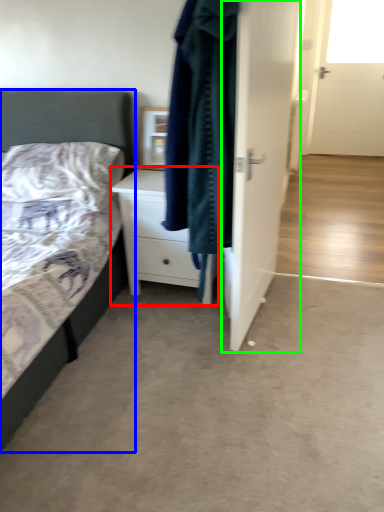
Question: Estimate the real-world distances between objects in this image. Which object is farther from chest of drawers (highlighted by a red box), bed (highlighted by a blue box) or door (highlighted by a green box)?

Choices:
 (A) bed
 (B) door

Answer: (B)